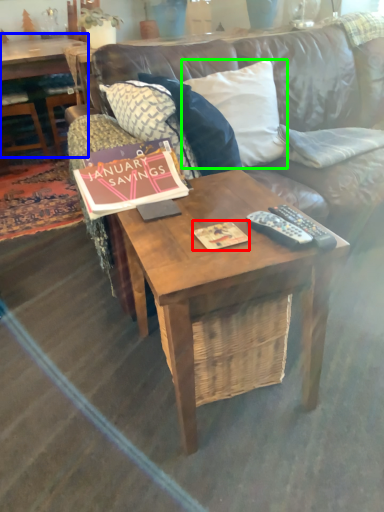
Question: Based on their relative distances, which object is nearer to magazine (highlighted by a red box)? Choose from coffee table (highlighted by a blue box) and pillow (highlighted by a green box).

Choices:
 (A) coffee table
 (B) pillow

Answer: (B)